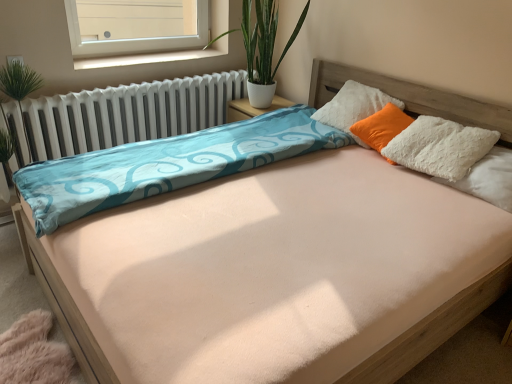
Image resolution: width=512 pixels, height=384 pixels. Describe the element at coordinates (146, 58) in the screenshot. I see `white plastic window sill at upper center` at that location.

What is the approximate height of white fluffy pillow at upper right, which is counted as the first pillow, starting from the left?

white fluffy pillow at upper right, which is counted as the first pillow, starting from the left, is 14.35 inches tall.

The width and height of the screenshot is (512, 384). I want to click on white fluffy pillow at upper right, which ranks as the second pillow in left-to-right order, so tap(488, 179).

From the image's perspective, is white fluffy pillow at upper right, placed as the first pillow when sorted from back to front, located above white fluffy pillow at upper right, which appears as the first pillow when viewed from the front?

Yes.

Considering the sizes of objects white fluffy pillow at upper right, placed as the first pillow when sorted from back to front, and white fluffy pillow at upper right, the first pillow positioned from the right, in the image provided, who is smaller, white fluffy pillow at upper right, placed as the first pillow when sorted from back to front, or white fluffy pillow at upper right, the first pillow positioned from the right,?

white fluffy pillow at upper right, placed as the first pillow when sorted from back to front, is smaller.

How different are the orientations of white fluffy pillow at upper right, which is counted as the first pillow, starting from the left, and white fluffy pillow at upper right, the first pillow positioned from the right, in degrees?

white fluffy pillow at upper right, which is counted as the first pillow, starting from the left, and white fluffy pillow at upper right, the first pillow positioned from the right, are facing 54.4 degrees away from each other.

Does point (371, 130) lie in front of point (459, 189)?

No.

Looking at this image, is green leafy plant at upper center positioned with its back to white plastic window sill at upper center?

No, white plastic window sill at upper center is not at the back of green leafy plant at upper center.

Is green leafy plant at upper center further to camera compared to white plastic window sill at upper center?

No, green leafy plant at upper center is closer to the camera.

Which is further, (269, 53) or (206, 57)?

The point (206, 57) is farther from the camera.

From a real-world perspective, is white plastic window sill at upper center on white fluffy pillow at upper right, placed as the first pillow when sorted from back to front?

Yes.

Image resolution: width=512 pixels, height=384 pixels. Find the location of `window sill that is above the white fluffy pillow at upper right, placed as the first pillow when sorted from back to front (from the image's perspective)`. window sill that is above the white fluffy pillow at upper right, placed as the first pillow when sorted from back to front (from the image's perspective) is located at coordinates (146, 58).

From the image's perspective, which is below, white plastic window sill at upper center or white fluffy pillow at upper right, the second pillow from the right?

white fluffy pillow at upper right, the second pillow from the right, appears lower in the image.

From the image's perspective, relative to white plastic window at upper left, is white plastic window sill at upper center above or below?

white plastic window sill at upper center is below white plastic window at upper left.

In the scene shown: Is there a large distance between white plastic window sill at upper center and white plastic window at upper left?

Yes, white plastic window sill at upper center and white plastic window at upper left are located far from each other.

Is white plastic window sill at upper center thinner than white plastic window at upper left?

In fact, white plastic window sill at upper center might be wider than white plastic window at upper left.

Does white plastic window sill at upper center have a lesser height compared to white plastic window at upper left?

Yes, white plastic window sill at upper center is shorter than white plastic window at upper left.

How many degrees apart are the facing directions of white fluffy pillow at upper right, the first pillow positioned from the right, and white fluffy pillow at upper right, placed as the first pillow when sorted from back to front?

There is a 54.4-degree angle between the facing directions of white fluffy pillow at upper right, the first pillow positioned from the right, and white fluffy pillow at upper right, placed as the first pillow when sorted from back to front.

Measure the distance between white fluffy pillow at upper right, the first pillow positioned from the right, and white fluffy pillow at upper right, placed as the first pillow when sorted from back to front.

white fluffy pillow at upper right, the first pillow positioned from the right, and white fluffy pillow at upper right, placed as the first pillow when sorted from back to front, are 18.16 inches apart from each other.

Could you tell me if white fluffy pillow at upper right, which is counted as the second pillow, starting from the back, is facing white fluffy pillow at upper right, which is counted as the first pillow, starting from the left?

No, white fluffy pillow at upper right, which is counted as the second pillow, starting from the back, is not oriented towards white fluffy pillow at upper right, which is counted as the first pillow, starting from the left.

Is white fluffy pillow at upper right, which ranks as the second pillow in left-to-right order, in front of white fluffy pillow at upper right, the second pillow from the right?

Yes.

Is point (106, 43) positioned after point (200, 52)?

No, (106, 43) is closer to viewer.

Consider the image. From the image's perspective, is white plastic window at upper left above white plastic window sill at upper center?

Yes, from the image's perspective, white plastic window at upper left is above white plastic window sill at upper center.

What's the angular difference between white plastic window at upper left and white plastic window sill at upper center's facing directions?

They differ by 0.103 degrees in their facing directions.

Which of these two, white plastic window at upper left or white plastic window sill at upper center, is bigger?

white plastic window at upper left is bigger.

From the image's perspective, is green leafy plant at upper center located above white plastic window at upper left?

Actually, green leafy plant at upper center appears below white plastic window at upper left in the image.

Is green leafy plant at upper center facing away from white plastic window at upper left?

That's not correct — green leafy plant at upper center is not looking away from white plastic window at upper left.

Are green leafy plant at upper center and white plastic window at upper left located far from each other?

green leafy plant at upper center is positioned a significant distance from white plastic window at upper left.

In the scene shown: In terms of height, does green leafy plant at upper center look taller or shorter compared to white plastic window at upper left?

Considering their sizes, green leafy plant at upper center has more height than white plastic window at upper left.

Image resolution: width=512 pixels, height=384 pixels. I want to click on pillow below the white fluffy pillow at upper right, arranged as the second pillow when viewed from the front (from a real-world perspective), so click(x=488, y=179).

Locate an element on the screen. The image size is (512, 384). plant that appears below the white plastic window sill at upper center (from the image's perspective) is located at coordinates (262, 39).

From the image, which object appears to be farther from white plastic window sill at upper center, white plastic window at upper left or white fluffy pillow at upper right, which ranks as the second pillow in left-to-right order?

The object further to white plastic window sill at upper center is white fluffy pillow at upper right, which ranks as the second pillow in left-to-right order.

When comparing their distances from white metallic radiator at left, does white fluffy pillow at upper right, which appears as the first pillow when viewed from the front, or white plastic window at upper left seem further?

white fluffy pillow at upper right, which appears as the first pillow when viewed from the front, is positioned further to the anchor white metallic radiator at left.

Estimate the real-world distances between objects in this image. Which object is closer to white metallic radiator at left, white fluffy pillow at upper right, placed as the first pillow when sorted from back to front, or white fluffy pillow at upper right, which is counted as the second pillow, starting from the back?

The object closer to white metallic radiator at left is white fluffy pillow at upper right, placed as the first pillow when sorted from back to front.

Which object lies nearer to the anchor point white fluffy pillow at upper right, which appears as the first pillow when viewed from the front, white plastic window sill at upper center or white metallic radiator at left?

white metallic radiator at left is closer to white fluffy pillow at upper right, which appears as the first pillow when viewed from the front.

When comparing their distances from white fluffy pillow at upper right, arranged as the second pillow when viewed from the front, does green leafy plant at upper center or white metallic radiator at left seem closer?

green leafy plant at upper center is closer to white fluffy pillow at upper right, arranged as the second pillow when viewed from the front.

Looking at this image, considering their positions, is white fluffy pillow at upper right, which appears as the first pillow when viewed from the front, positioned further to white plastic window at upper left than white plastic window sill at upper center?

white fluffy pillow at upper right, which appears as the first pillow when viewed from the front, lies further to white plastic window at upper left than the other object.

Which object lies nearer to the anchor point white metallic radiator at left, white fluffy pillow at upper right, placed as the first pillow when sorted from back to front, or white plastic window sill at upper center?

The object closer to white metallic radiator at left is white plastic window sill at upper center.

From the picture: Considering their positions, is white metallic radiator at left positioned further to white fluffy pillow at upper right, which ranks as the second pillow in left-to-right order, than green leafy plant at upper center?

white metallic radiator at left lies further to white fluffy pillow at upper right, which ranks as the second pillow in left-to-right order, than the other object.

Identify the location of window sill between white plastic window at upper left and green leafy plant at upper center. The width and height of the screenshot is (512, 384). (146, 58).

At what (x,y) coordinates should I click in order to perform the action: click on window sill between white plastic window at upper left and white metallic radiator at left from top to bottom. Please return your answer as a coordinate pair (x, y). Looking at the image, I should click on (146, 58).

At what (x,y) coordinates should I click in order to perform the action: click on window sill between white plastic window at upper left and white fluffy pillow at upper right, which is counted as the first pillow, starting from the left, from left to right. Please return your answer as a coordinate pair (x, y). Looking at the image, I should click on (146, 58).

The width and height of the screenshot is (512, 384). Find the location of `plant situated between white plastic window at upper left and white fluffy pillow at upper right, which ranks as the second pillow in left-to-right order, from left to right`. plant situated between white plastic window at upper left and white fluffy pillow at upper right, which ranks as the second pillow in left-to-right order, from left to right is located at coordinates (262, 39).